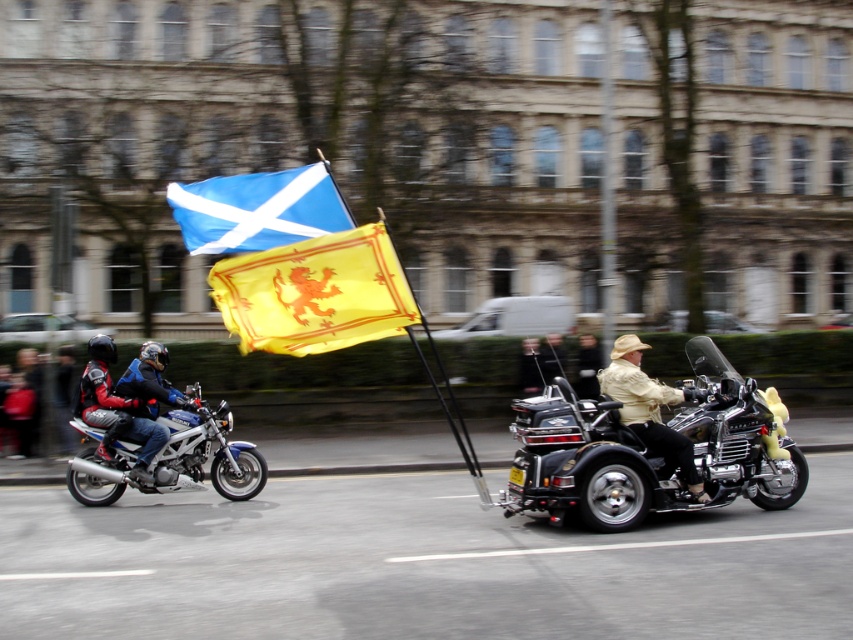
You are a pedestrian standing at point [175,458]. You see the metallic blue motorcycle at left and the trike on the right. Which vehicle is closer to you?

The metallic blue motorcycle at left is closer to you because it is located at point [175,458].

You are a pedestrian standing at the side of the street watching the two motorcycles. You notice the blue fabric flag at center and the light brown leather jacket at center. Which one is closer to you?

The blue fabric flag at center is closer to you because it is in front of the light brown leather jacket at center.